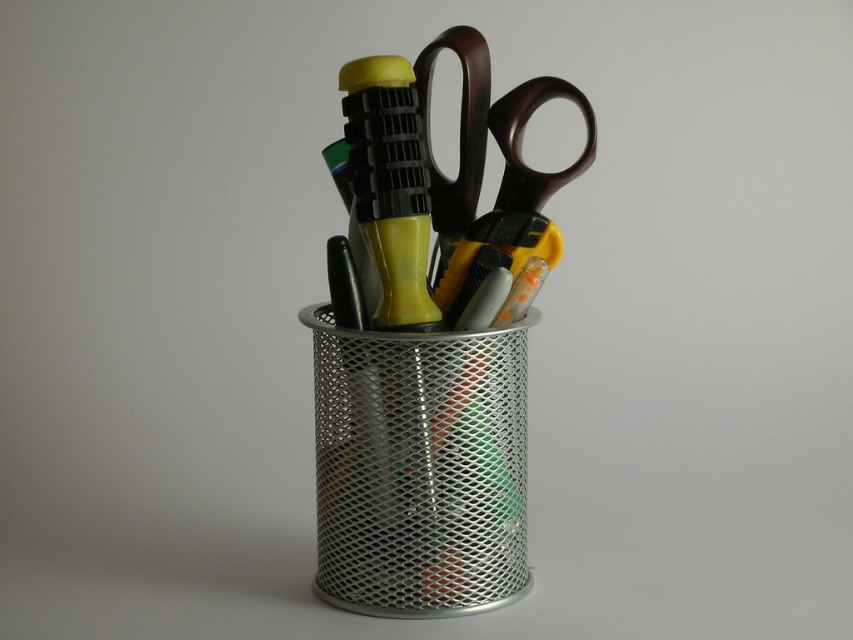
Question: Which of the following is the closest to the observer?

Choices:
 (A) metal mesh pen holder at center
 (B) brown plastic scissors at center

Answer: (A)

Question: Observing the image, what is the correct spatial positioning of metal mesh pen holder at center in reference to brown plastic scissors at center?

Choices:
 (A) above
 (B) below

Answer: (B)

Question: Does metal mesh pen holder at center appear on the right side of brown plastic scissors at center?

Choices:
 (A) no
 (B) yes

Answer: (A)

Question: Which point appears farthest from the camera in this image?

Choices:
 (A) pos(421,467)
 (B) pos(506,106)

Answer: (B)

Question: Is metal mesh pen holder at center positioned behind brown plastic scissors at center?

Choices:
 (A) yes
 (B) no

Answer: (B)